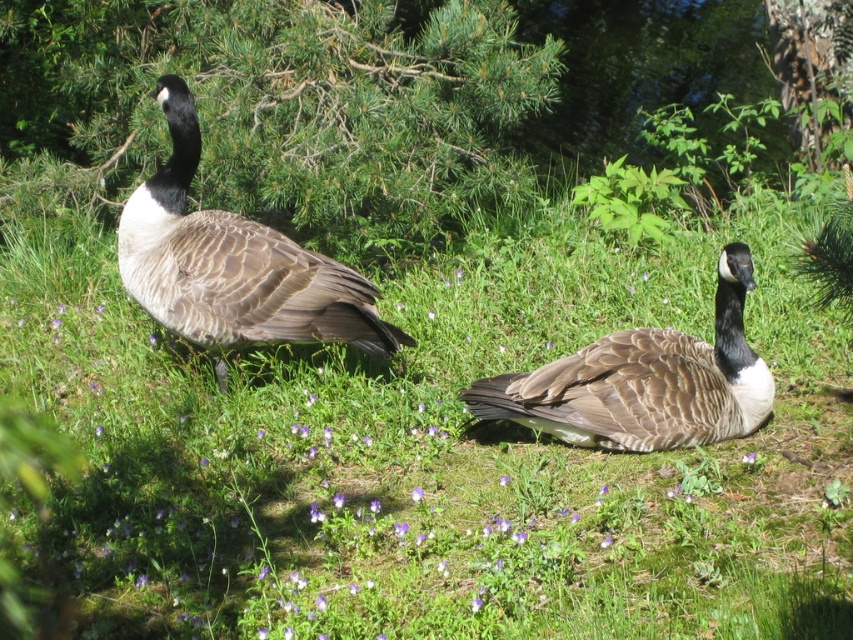
Question: Does brown textured grass at center have a lesser width compared to brown feathered goose at left?

Choices:
 (A) no
 (B) yes

Answer: (A)

Question: Is brown textured grass at center wider than green needle-like leaves at upper left?

Choices:
 (A) yes
 (B) no

Answer: (A)

Question: Which point is farther to the camera?

Choices:
 (A) green needle-like leaves at upper left
 (B) brown feathered goose at left
 (C) brown feathered goose at center
 (D) brown textured grass at center

Answer: (A)

Question: Which object is positioned closest to the green needle-like leaves at upper left?

Choices:
 (A) brown feathered goose at left
 (B) brown textured grass at center
 (C) brown feathered goose at center

Answer: (B)

Question: Can you confirm if green needle-like leaves at upper left is positioned to the right of brown feathered goose at center?

Choices:
 (A) no
 (B) yes

Answer: (A)

Question: Among these points, which one is nearest to the camera?

Choices:
 (A) (260, 438)
 (B) (195, 220)

Answer: (A)